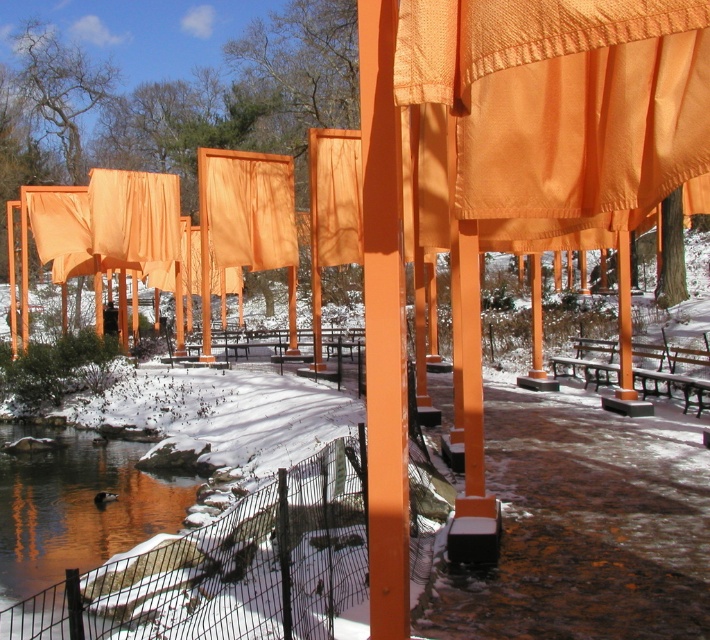
You are standing at the viewpoint of the image and want to place a small flag at the closest point between point (420, 81) and point (200, 186). Which point should you choose?

Point (420, 81) is closer to the camera than point (200, 186), so you should place the flag at point (420, 81).

You are standing on the pathway and want to take a photo of both the smooth water at lower left and the orange fabric curtain at center. Which object should you position closer to the left side of your camera frame?

You should position the smooth water at lower left closer to the left side of your camera frame since it is already on the left side of the orange fabric curtain at center.

You are an artist planning to hang a new artwork between the orange satin curtain at center and the orange fabric curtain at center. Which curtain should you place the artwork closer to if you want it to be centered between both curtains?

The artwork should be placed closer to the orange satin curtain at center because it has a narrower width than the orange fabric curtain at center, so the midpoint between them would be closer to the narrower curtain.